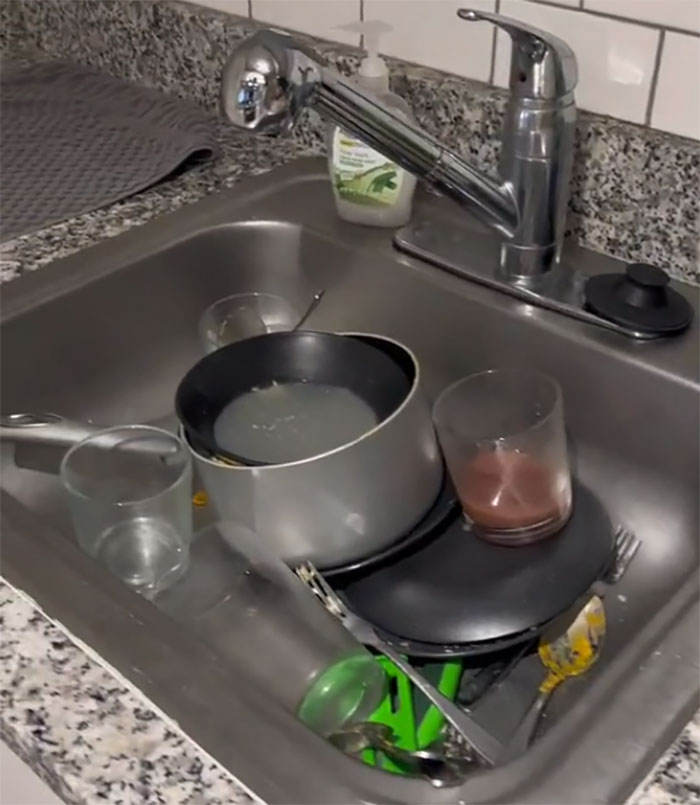
Identify the location of sink handle. The image size is (700, 805). (535, 69).